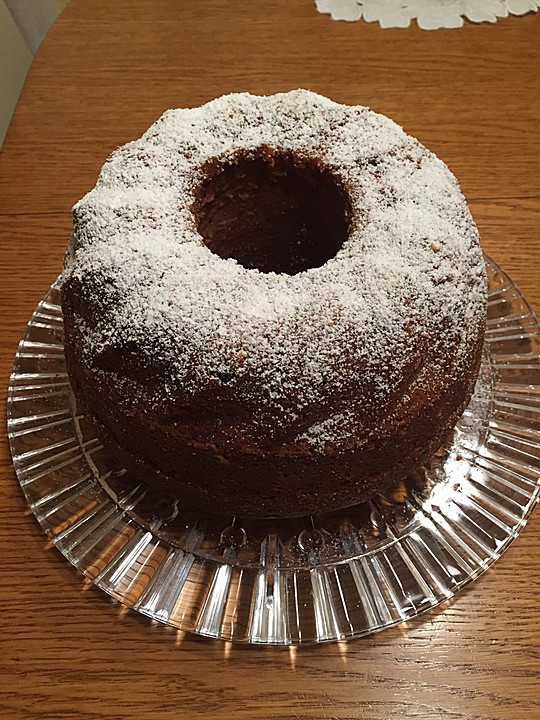
You are a GUI agent. You are given a task and a screenshot of the screen. Output one action in this format:
    pyautogui.click(x=<x>, y=<y>)
    Task: Click on the mat
    Image resolution: width=540 pixels, height=720 pixels.
    Given the screenshot: What is the action you would take?
    pyautogui.click(x=413, y=13)